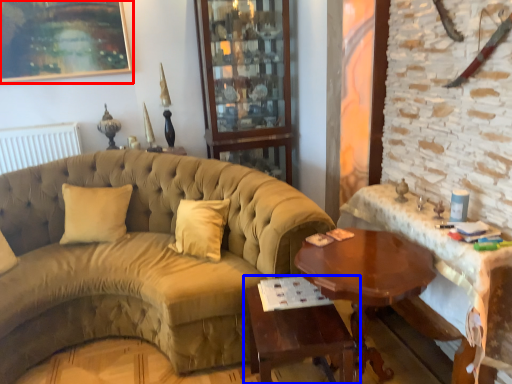
Question: Which object appears farthest to the camera in this image, picture frame (highlighted by a red box) or table (highlighted by a blue box)?

Choices:
 (A) picture frame
 (B) table

Answer: (A)